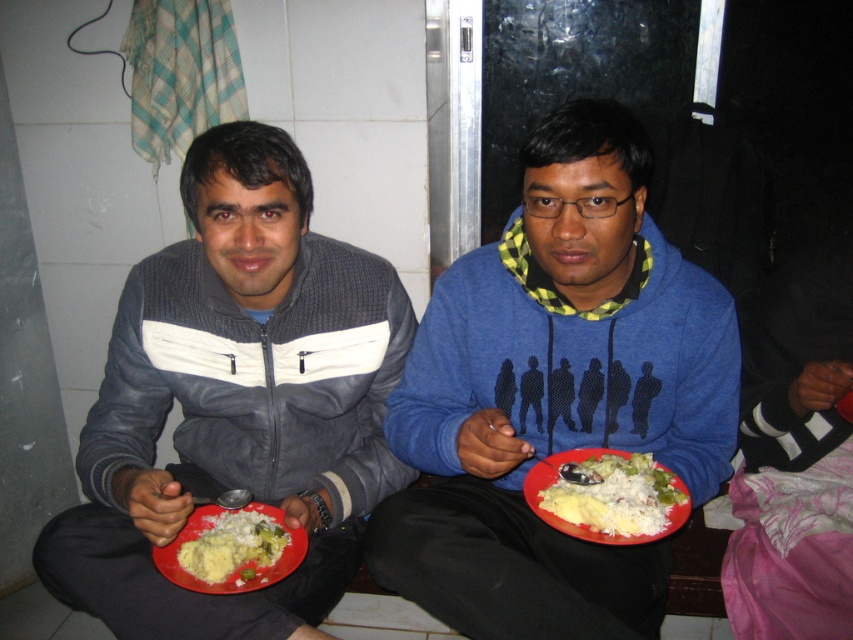
Question: Among these objects, which one is farthest from the camera?

Choices:
 (A) white rice with green vegetables at lower left
 (B) white matte rice at center
 (C) blue fleece hoodie at center
 (D) matte gray jacket at left

Answer: (D)

Question: Estimate the real-world distances between objects in this image. Which object is farther from the blue fleece hoodie at center?

Choices:
 (A) matte gray jacket at left
 (B) white rice with green vegetables at lower left
 (C) white matte rice at center

Answer: (B)

Question: Observing the image, what is the correct spatial positioning of matte gray jacket at left in reference to white matte rice at center?

Choices:
 (A) right
 (B) left

Answer: (B)

Question: Does white matte rice at center have a greater width compared to white rice with green vegetables at lower left?

Choices:
 (A) no
 (B) yes

Answer: (B)

Question: Is blue fleece hoodie at center in front of matte gray jacket at left?

Choices:
 (A) yes
 (B) no

Answer: (A)

Question: Which point is closer to the camera?

Choices:
 (A) white rice with green vegetables at lower left
 (B) white matte rice at center
 (C) blue fleece hoodie at center
 (D) matte gray jacket at left

Answer: (B)